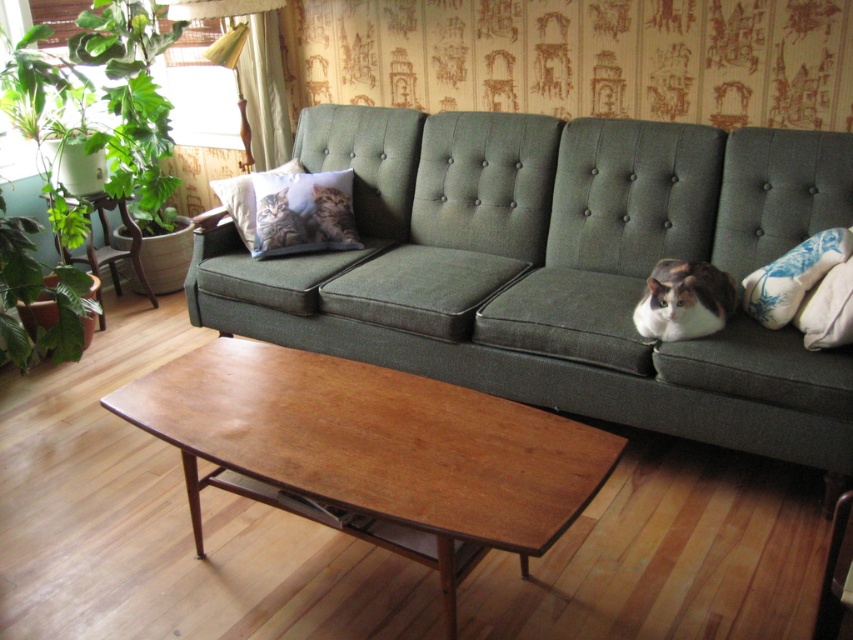
Between blue floral pillow at right and printed fabric pillow with cat image at center, which one has less height?

With less height is blue floral pillow at right.

Is point (753, 298) more distant than point (234, 216)?

No, it is not.

Based on the photo, who is more distant from viewer, [788,307] or [234,205]?

The point [234,205] is more distant.

Where is `blue floral pillow at right`? Image resolution: width=853 pixels, height=640 pixels. blue floral pillow at right is located at coordinates (793, 276).

Can you confirm if soft gray fabric pillow at center is bigger than blue floral pillow at right?

Indeed, soft gray fabric pillow at center has a larger size compared to blue floral pillow at right.

Can you confirm if soft gray fabric pillow at center is taller than blue floral pillow at right?

Correct, soft gray fabric pillow at center is much taller as blue floral pillow at right.

Does point (260, 236) come behind point (786, 321)?

That is True.

Find the location of a particular element. Image resolution: width=853 pixels, height=640 pixels. soft gray fabric pillow at center is located at coordinates (303, 212).

The height and width of the screenshot is (640, 853). What do you see at coordinates (372, 451) in the screenshot?
I see `wooden coffee table at center` at bounding box center [372, 451].

Is point (368, 444) positioned after point (132, 243)?

No, it is not.

Find the location of a particular element. This screenshot has height=640, width=853. wooden coffee table at center is located at coordinates (372, 451).